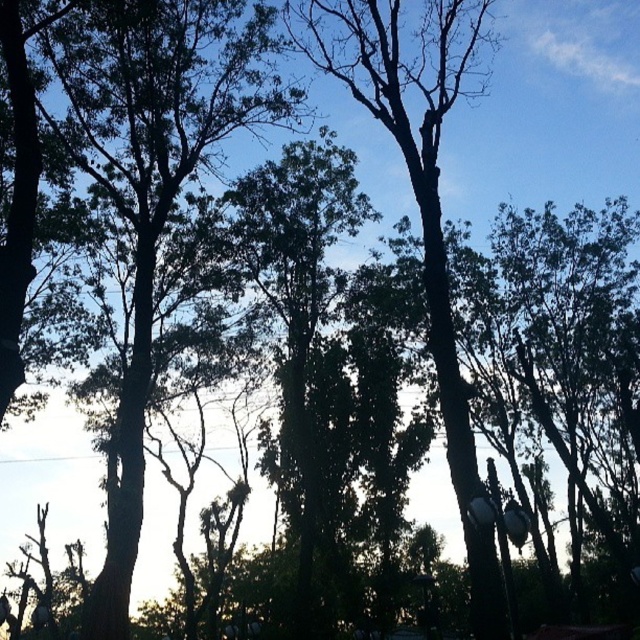
Who is positioned more to the right, dark green leafy tree at upper left or green leafy tree at center?

green leafy tree at center

Does dark green leafy tree at upper left appear under green leafy tree at center?

Yes.

What do you see at coordinates (154, 176) in the screenshot? I see `dark green leafy tree at upper left` at bounding box center [154, 176].

Locate an element on the screen. The height and width of the screenshot is (640, 640). dark green leafy tree at upper left is located at coordinates (154, 176).